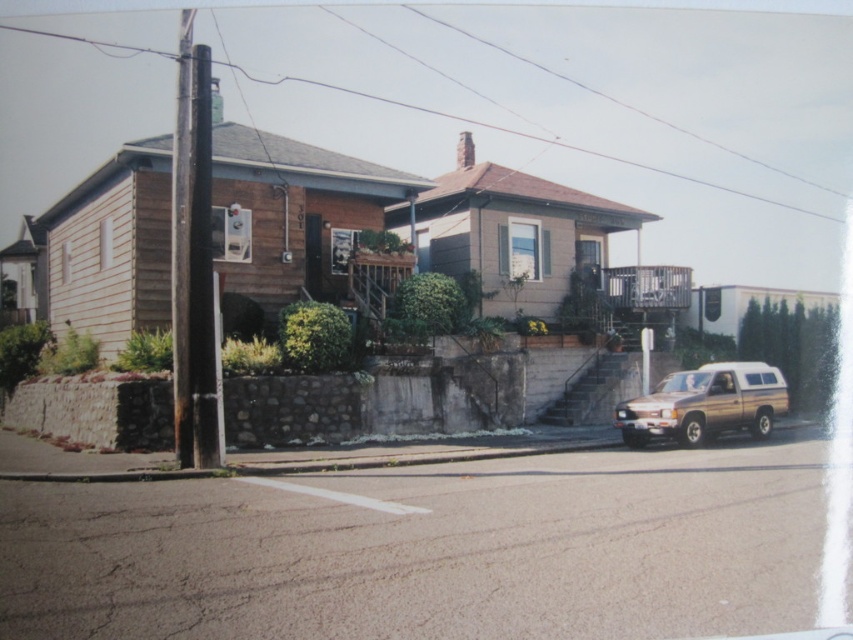
Question: Does gold metallic van at lower right appear over brown wooden power line at upper center?

Choices:
 (A) no
 (B) yes

Answer: (A)

Question: Does gold metallic van at lower right have a greater width compared to brown wooden power line at upper center?

Choices:
 (A) no
 (B) yes

Answer: (A)

Question: Which point appears farthest from the camera in this image?

Choices:
 (A) (688, 435)
 (B) (595, 154)

Answer: (B)

Question: Is gold metallic van at lower right wider than brown wooden power line at upper center?

Choices:
 (A) yes
 (B) no

Answer: (B)

Question: Among these objects, which one is nearest to the camera?

Choices:
 (A) brown wooden power line at upper center
 (B) gold metallic van at lower right

Answer: (A)